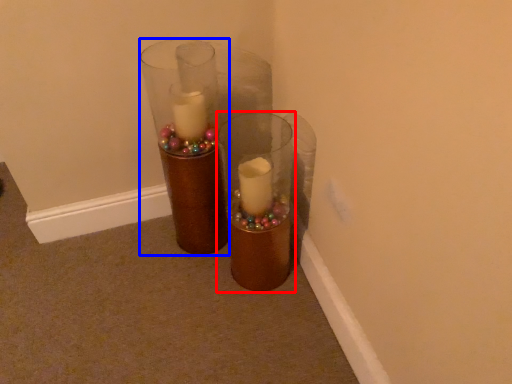
Question: Among these objects, which one is nearest to the camera, vase (highlighted by a red box) or vase (highlighted by a blue box)?

Choices:
 (A) vase
 (B) vase

Answer: (A)